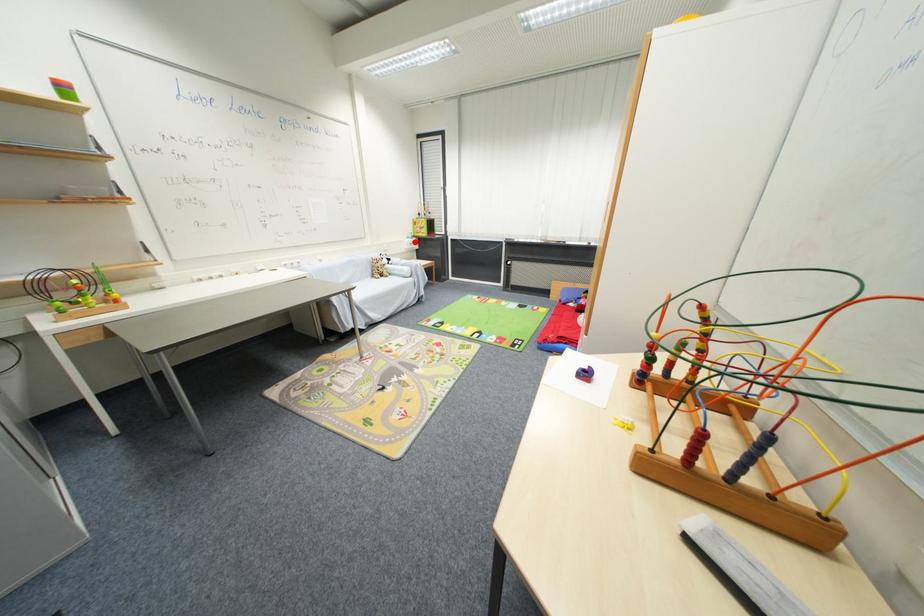
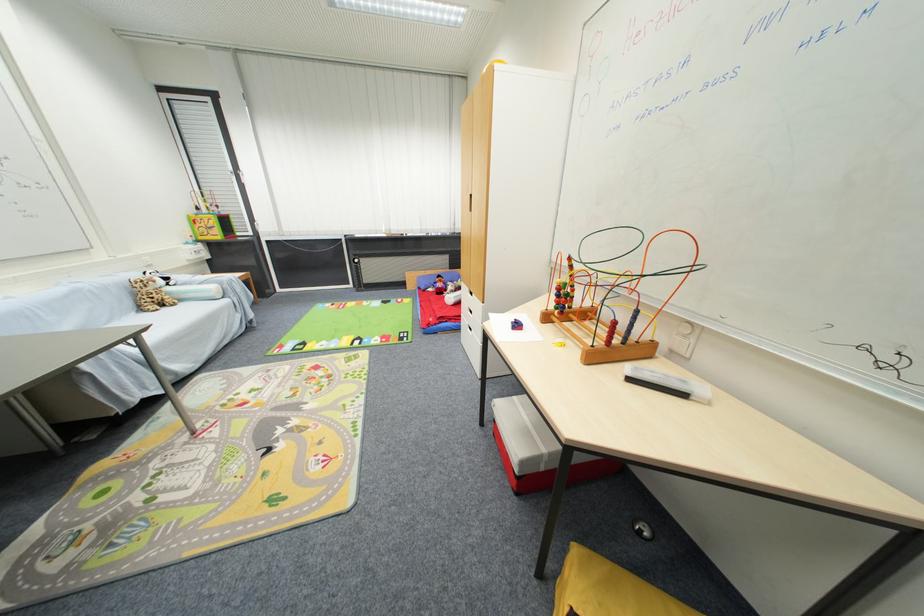
Where in the second image is the point corresponding to the highlighted location from the first image?

(198, 249)